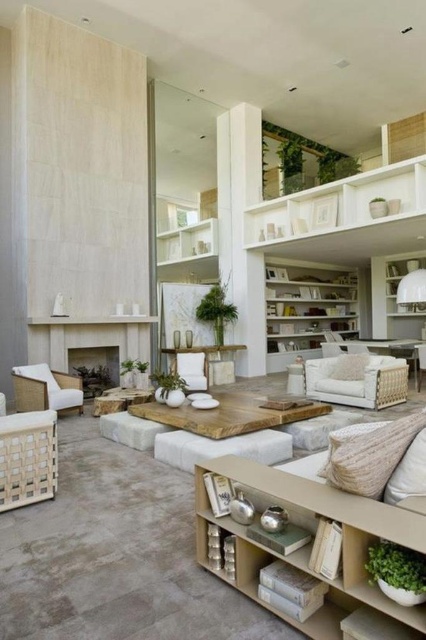
Question: Which object appears closest to the camera in this image?

Choices:
 (A) white wood stool at center
 (B) white wicker armchair at center

Answer: (A)

Question: In this image, where is white wood bookshelf at center located relative to white fabric armchair at center?

Choices:
 (A) above
 (B) below

Answer: (A)

Question: Which object is positioned farthest from the matte stone fireplace at center?

Choices:
 (A) white wicker armchair at center
 (B) woven rattan armchair at left
 (C) white wood bookshelf at center
 (D) white fabric armchair at center

Answer: (C)

Question: Considering the real-world distances, which object is farthest from the white wood bookshelf at center?

Choices:
 (A) woven rattan armchair at left
 (B) white wicker armchair at center

Answer: (A)

Question: Is white wood bookshelf at center closer to camera compared to white textured pillow at center?

Choices:
 (A) yes
 (B) no

Answer: (B)

Question: Can you confirm if white wood bookshelf at center is positioned above white wicker armchair at center?

Choices:
 (A) no
 (B) yes

Answer: (B)